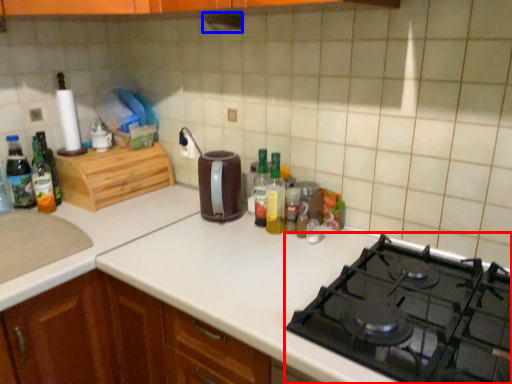
Question: Which object appears farthest to the camera in this image, gas stove (highlighted by a red box) or exhaust hood (highlighted by a blue box)?

Choices:
 (A) gas stove
 (B) exhaust hood

Answer: (B)